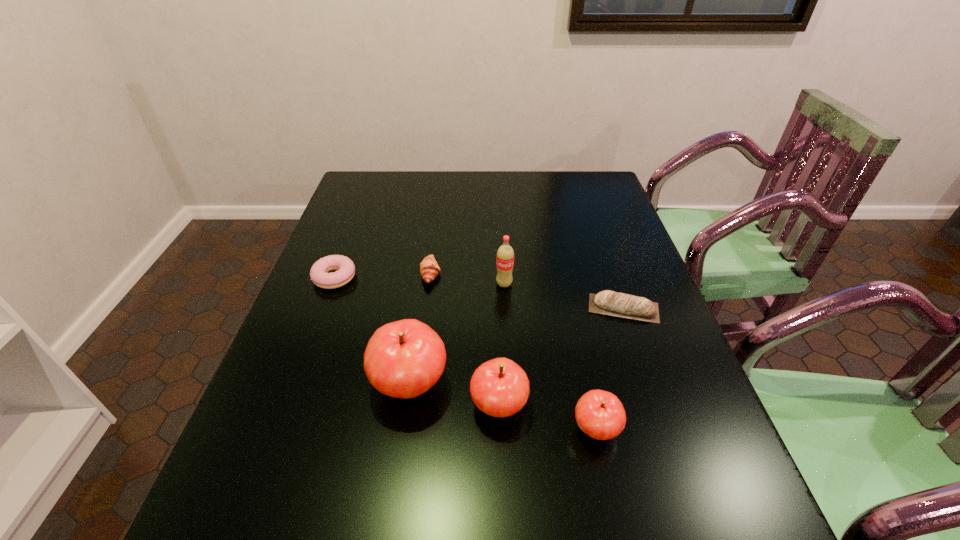
Identify the location of the tallest apple. (403, 359).

Where is `the fifth shortest object`? This screenshot has height=540, width=960. the fifth shortest object is located at coordinates (499, 387).

I want to click on the second apple from right to left, so click(499, 387).

This screenshot has width=960, height=540. I want to click on the shortest apple, so click(600, 414).

Locate an element on the screen. The image size is (960, 540). the rightmost apple is located at coordinates (600, 414).

At what (x,y) coordinates should I click in order to perform the action: click on pastry. Please return your answer as a coordinate pair (x, y). This screenshot has width=960, height=540. Looking at the image, I should click on (429, 268).

This screenshot has height=540, width=960. What are the coordinates of `doughnut` in the screenshot? It's located at (319, 274).

Identify the location of the fourth nearest object. tap(607, 302).

You are a GUI agent. You are given a task and a screenshot of the screen. Output one action in this format:
    pyautogui.click(x=<x>, y=<y>)
    Task: Click on the soda
    The width and height of the screenshot is (960, 540).
    Given the screenshot: What is the action you would take?
    pyautogui.click(x=505, y=255)

You are a GUI agent. You are given a task and a screenshot of the screen. Output one action in this format:
    pyautogui.click(x=<x>, y=<y>)
    Task: Click on the vacant space located 0.050m on the front of the leftmost apple
    The image size is (960, 540).
    Given the screenshot: What is the action you would take?
    pyautogui.click(x=401, y=443)